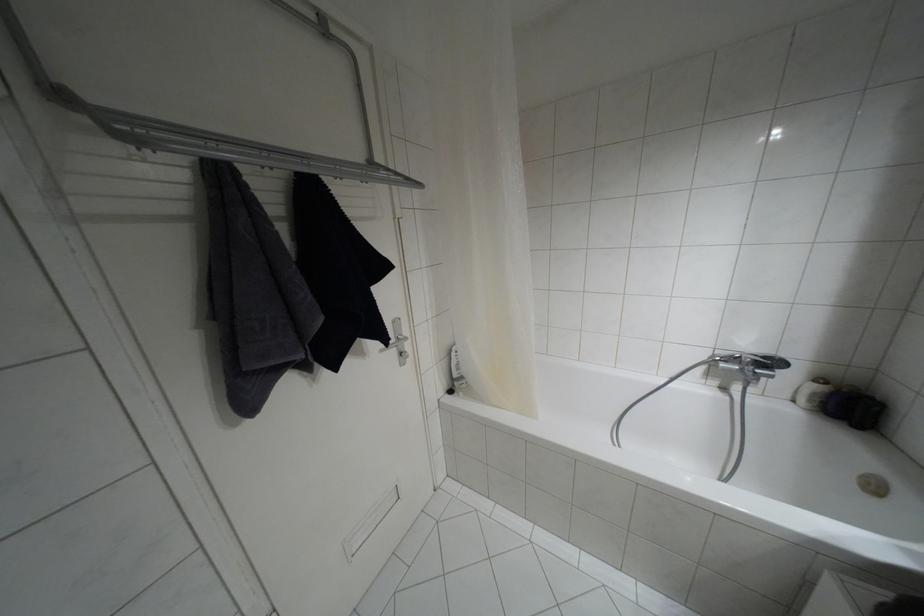
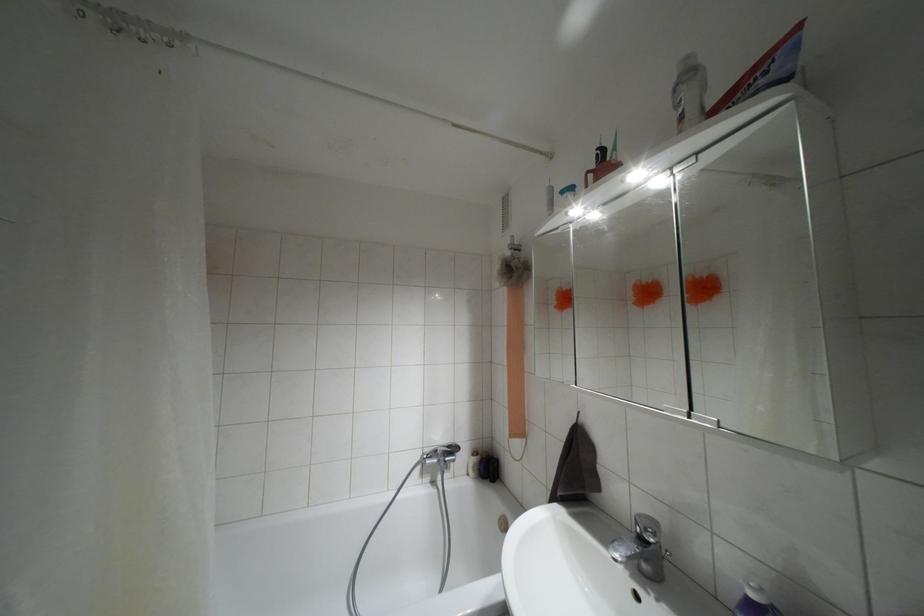
The images are taken continuously from a first-person perspective. In which direction is your viewpoint rotating?

The camera's rotation is toward right-up.